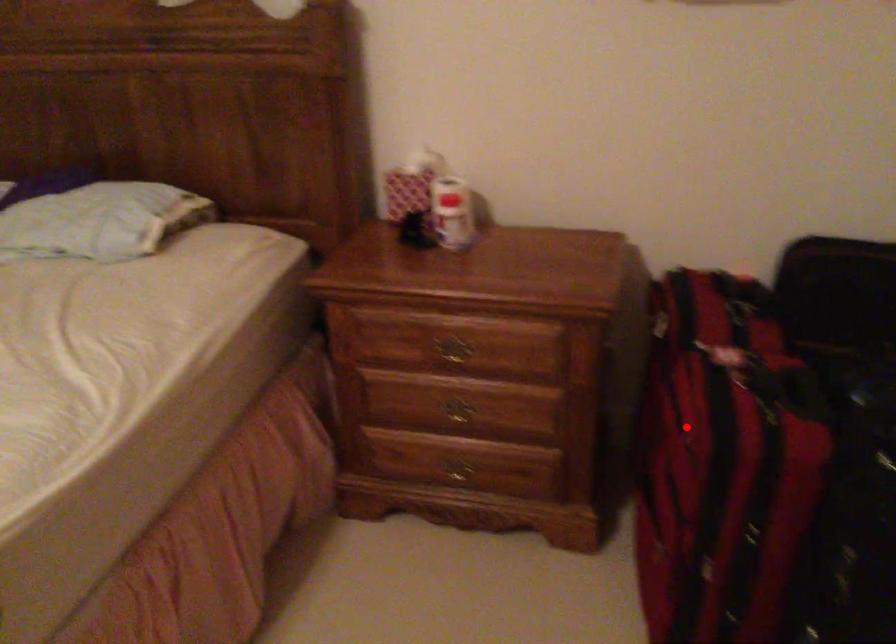
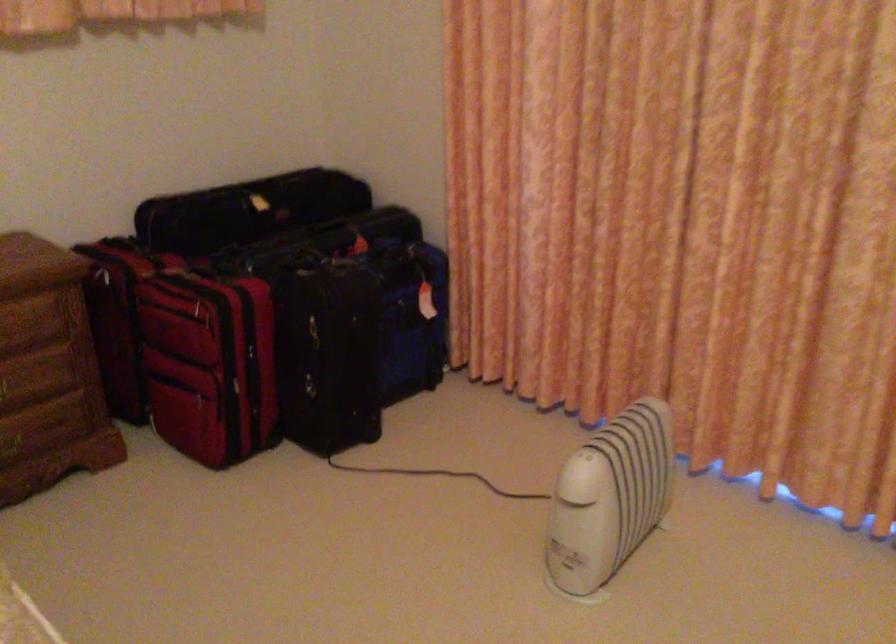
Question: A red point is marked in image1. In image2, is the corresponding 3D point closer to the camera or farther? Reply with the corresponding letter.

Choices:
 (A) The corresponding 3D point is closer.
 (B) The corresponding 3D point is farther.

Answer: (B)